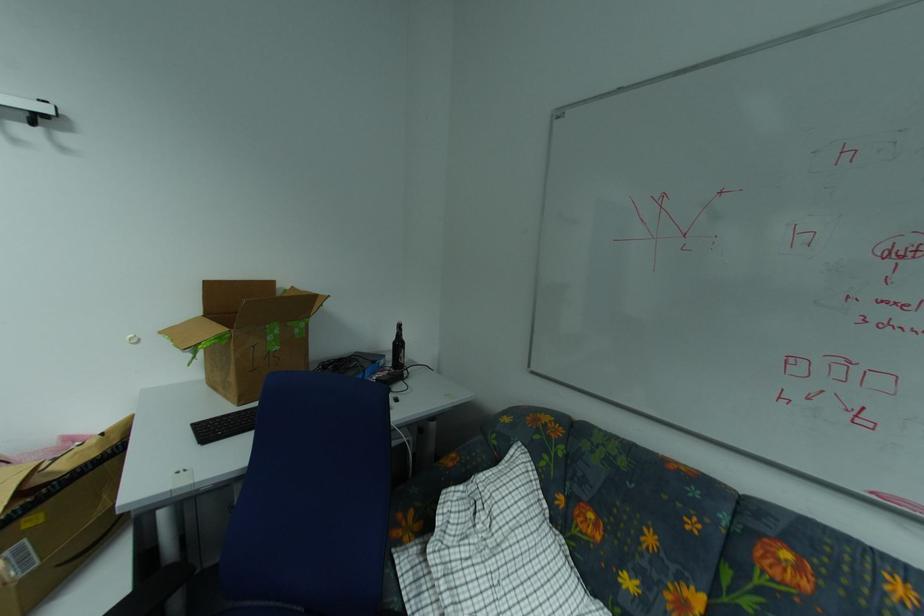
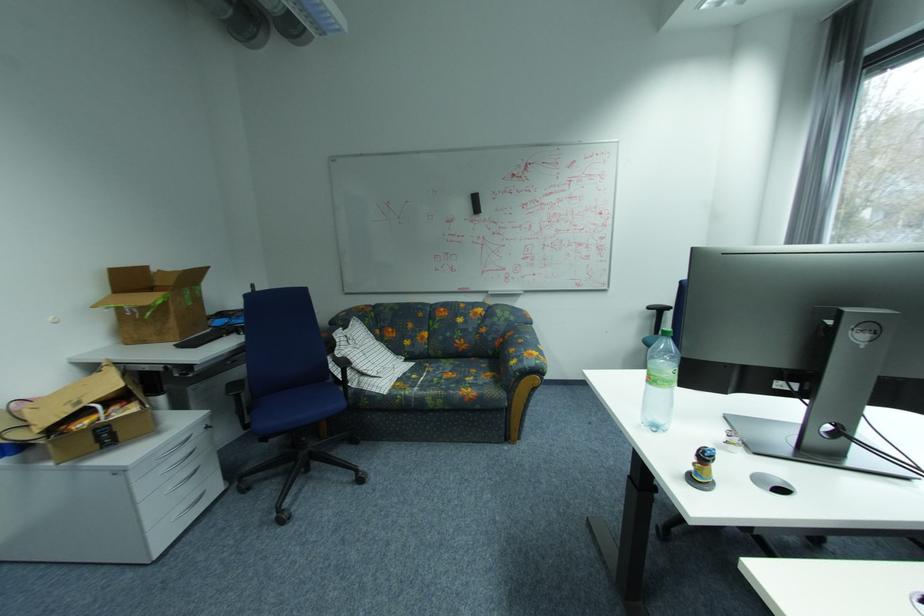
Find the pixel in the second image that matches (241,379) in the first image.

(180, 323)